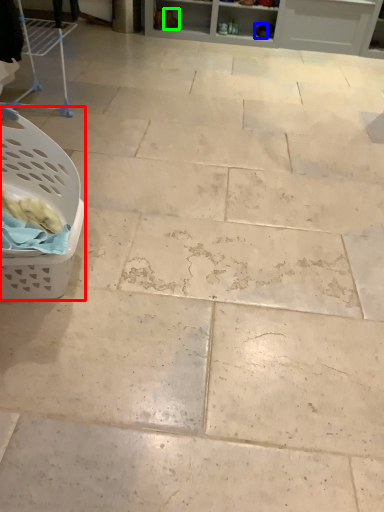
Question: Based on their relative distances, which object is farther from basket (highlighted by a red box)? Choose from footwear (highlighted by a blue box) and footwear (highlighted by a green box).

Choices:
 (A) footwear
 (B) footwear

Answer: (A)